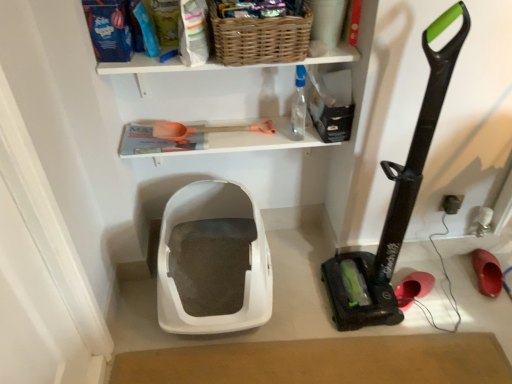
Locate an element on the screen. The height and width of the screenshot is (384, 512). vacant area that is in front of rubberized red shoe at lower right, the first footwear from the left is located at coordinates (424, 319).